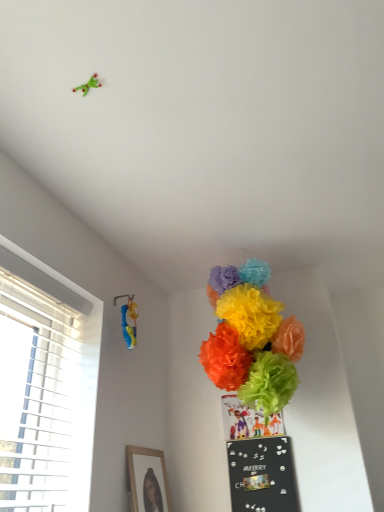
Question: Can you confirm if wooden framed picture at lower left is wider than black matte bulletin board at lower center?

Choices:
 (A) yes
 (B) no

Answer: (A)

Question: Is black matte bulletin board at lower center a part of wooden framed picture at lower left?

Choices:
 (A) yes
 (B) no

Answer: (B)

Question: Is wooden framed picture at lower left facing towards black matte bulletin board at lower center?

Choices:
 (A) yes
 (B) no

Answer: (A)

Question: Can you confirm if wooden framed picture at lower left is smaller than black matte bulletin board at lower center?

Choices:
 (A) no
 (B) yes

Answer: (A)

Question: Is the surface of wooden framed picture at lower left in direct contact with black matte bulletin board at lower center?

Choices:
 (A) yes
 (B) no

Answer: (B)

Question: Is wooden framed picture at lower left turned away from black matte bulletin board at lower center?

Choices:
 (A) no
 (B) yes

Answer: (A)

Question: Is blue plastic toy at upper left facing away from wooden framed picture at lower left?

Choices:
 (A) yes
 (B) no

Answer: (B)

Question: Is blue plastic toy at upper left touching wooden framed picture at lower left?

Choices:
 (A) yes
 (B) no

Answer: (B)

Question: From the image's perspective, would you say blue plastic toy at upper left is positioned over wooden framed picture at lower left?

Choices:
 (A) yes
 (B) no

Answer: (A)

Question: Does blue plastic toy at upper left have a greater height compared to wooden framed picture at lower left?

Choices:
 (A) yes
 (B) no

Answer: (B)

Question: Can you confirm if blue plastic toy at upper left is bigger than wooden framed picture at lower left?

Choices:
 (A) yes
 (B) no

Answer: (B)

Question: From the image's perspective, is blue plastic toy at upper left beneath wooden framed picture at lower left?

Choices:
 (A) yes
 (B) no

Answer: (B)

Question: Is black matte bulletin board at lower center closer to camera compared to blue plastic toy at upper left?

Choices:
 (A) yes
 (B) no

Answer: (B)